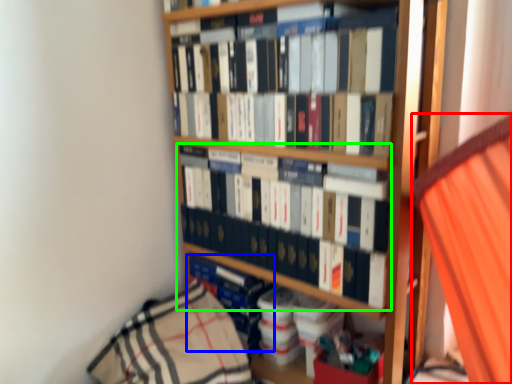
Question: Which is nearer to the curtain (highlighted by a red box)? book (highlighted by a blue box) or book (highlighted by a green box).

Choices:
 (A) book
 (B) book

Answer: (B)